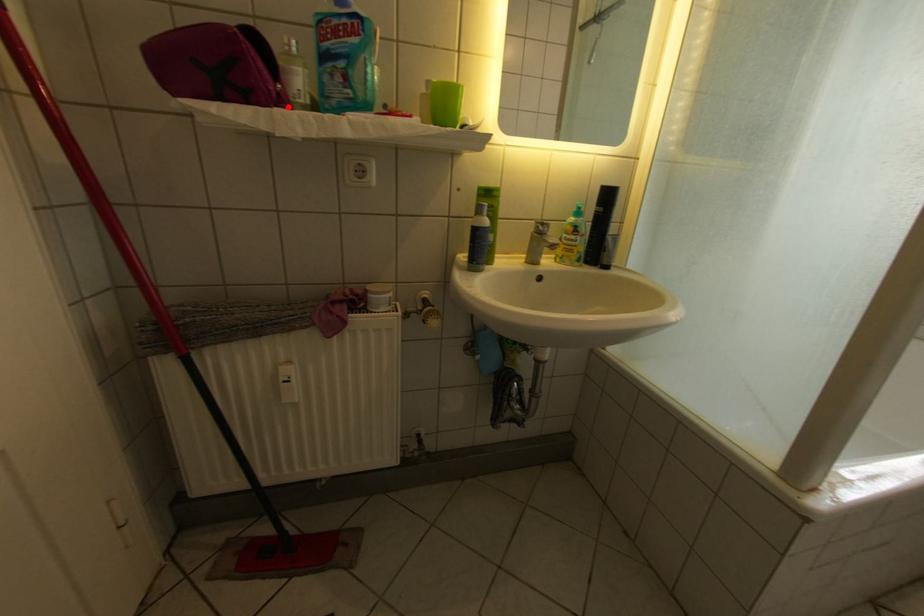
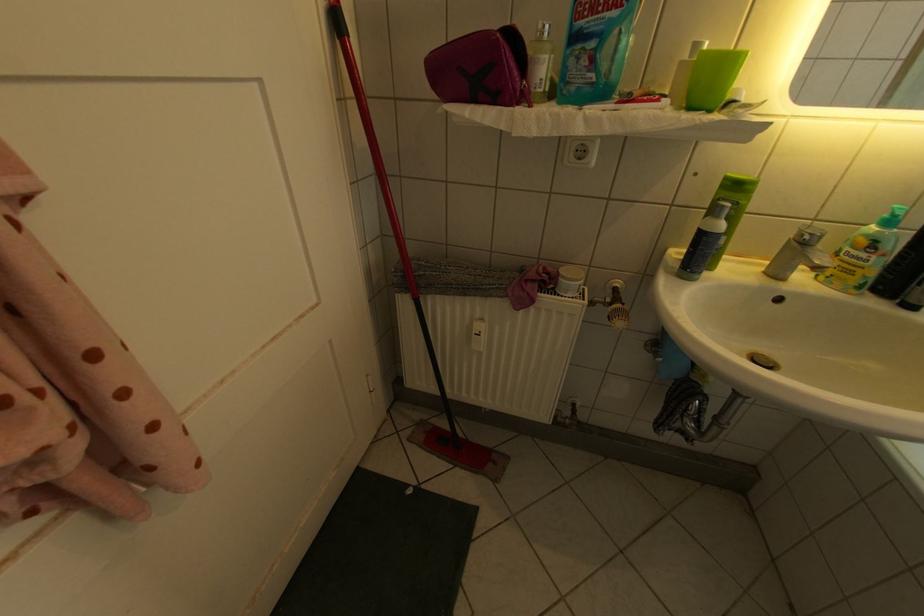
In the second image, find the point that corresponds to the highlighted location in the first image.

(530, 105)